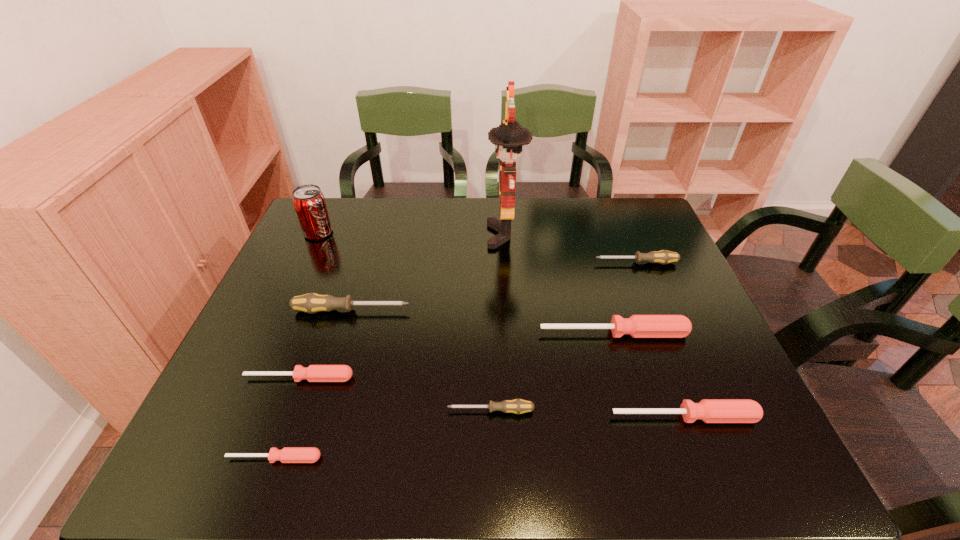
Locate an element on the screen. vacant space that is in between the smallest gray screwdriver and the third farthest red screwdriver is located at coordinates (588, 414).

You are a GUI agent. You are given a task and a screenshot of the screen. Output one action in this format:
    pyautogui.click(x=<x>, y=<y>)
    Task: Click on the unoccupied area between the fourth screwdriver from left to right and the third farthest screwdriver
    Image resolution: width=960 pixels, height=540 pixels.
    Given the screenshot: What is the action you would take?
    pyautogui.click(x=552, y=372)

The width and height of the screenshot is (960, 540). In order to click on vacant point located between the biggest red screwdriver and the nutcracker in this screenshot , I will do pyautogui.click(x=560, y=284).

Identify which object is the eighth closest to the second biggest red screwdriver. Please provide its 2D coordinates. Your answer should be formatted as a tuple, i.e. [(x, y)], where the tuple contains the x and y coordinates of a point satisfying the conditions above.

[(308, 200)]

The image size is (960, 540). Identify the location of object that is the fourth closest to the nearest gray screwdriver. (288, 454).

Select which screwdriver is the second closest to the farthest gray screwdriver. Please provide its 2D coordinates. Your answer should be formatted as a tuple, i.e. [(x, y)], where the tuple contains the x and y coordinates of a point satisfying the conditions above.

[(708, 410)]

Locate an element on the screen. This screenshot has width=960, height=540. screwdriver that is the second closest one to the nearest screwdriver is located at coordinates (517, 406).

Choose which gray screwdriver is the nearest neighbor to the second biggest gray screwdriver. Please provide its 2D coordinates. Your answer should be formatted as a tuple, i.e. [(x, y)], where the tuple contains the x and y coordinates of a point satisfying the conditions above.

[(517, 406)]

You are a GUI agent. You are given a task and a screenshot of the screen. Output one action in this format:
    pyautogui.click(x=<x>, y=<y>)
    Task: Click on the closest gray screwdriver to the sixth farthest object
    This screenshot has width=960, height=540.
    Given the screenshot: What is the action you would take?
    pyautogui.click(x=311, y=303)

Choose which red screwdriver is the nearest neighbor to the tallest object. Please provide its 2D coordinates. Your answer should be formatted as a tuple, i.e. [(x, y)], where the tuple contains the x and y coordinates of a point satisfying the conditions above.

[(638, 326)]